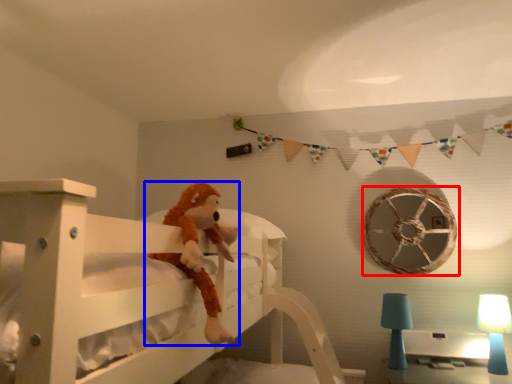
Question: Which of the following is the closest to the observer, wheel (highlighted by a red box) or toy (highlighted by a blue box)?

Choices:
 (A) wheel
 (B) toy

Answer: (B)